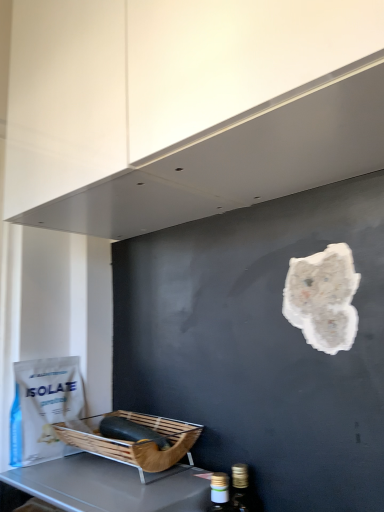
Question: Considering the relative positions of brown woven basket at lower left and white matte paper bag at lower left in the image provided, is brown woven basket at lower left to the right of white matte paper bag at lower left from the viewer's perspective?

Choices:
 (A) yes
 (B) no

Answer: (A)

Question: Does brown woven basket at lower left touch white matte paper bag at lower left?

Choices:
 (A) yes
 (B) no

Answer: (B)

Question: From a real-world perspective, is brown woven basket at lower left located higher than white matte paper bag at lower left?

Choices:
 (A) no
 (B) yes

Answer: (A)

Question: Considering the relative sizes of brown woven basket at lower left and white matte paper bag at lower left in the image provided, is brown woven basket at lower left smaller than white matte paper bag at lower left?

Choices:
 (A) no
 (B) yes

Answer: (A)

Question: From the image's perspective, is brown woven basket at lower left beneath white matte paper bag at lower left?

Choices:
 (A) yes
 (B) no

Answer: (A)

Question: From their relative heights in the image, would you say white matte paper bag at lower left is taller or shorter than white matte exhaust hood at upper center?

Choices:
 (A) tall
 (B) short

Answer: (B)

Question: From the image's perspective, is white matte paper bag at lower left above or below white matte exhaust hood at upper center?

Choices:
 (A) above
 (B) below

Answer: (B)

Question: Is white matte paper bag at lower left bigger or smaller than white matte exhaust hood at upper center?

Choices:
 (A) small
 (B) big

Answer: (A)

Question: Would you say white matte paper bag at lower left is inside or outside white matte exhaust hood at upper center?

Choices:
 (A) outside
 (B) inside

Answer: (A)

Question: From the image's perspective, relative to white matte paper bag at lower left, is white matte exhaust hood at upper center above or below?

Choices:
 (A) below
 (B) above

Answer: (B)

Question: From a real-world perspective, is white matte exhaust hood at upper center physically located above or below white matte paper bag at lower left?

Choices:
 (A) below
 (B) above

Answer: (B)

Question: Choose the correct answer: Is white matte exhaust hood at upper center inside white matte paper bag at lower left or outside it?

Choices:
 (A) outside
 (B) inside

Answer: (A)

Question: Is white matte exhaust hood at upper center to the left or to the right of white matte paper bag at lower left in the image?

Choices:
 (A) right
 (B) left

Answer: (A)

Question: Relative to wooden basket at lower left, is white matte exhaust hood at upper center in front or behind?

Choices:
 (A) front
 (B) behind

Answer: (A)

Question: Is white matte exhaust hood at upper center wider or thinner than wooden basket at lower left?

Choices:
 (A) wide
 (B) thin

Answer: (A)